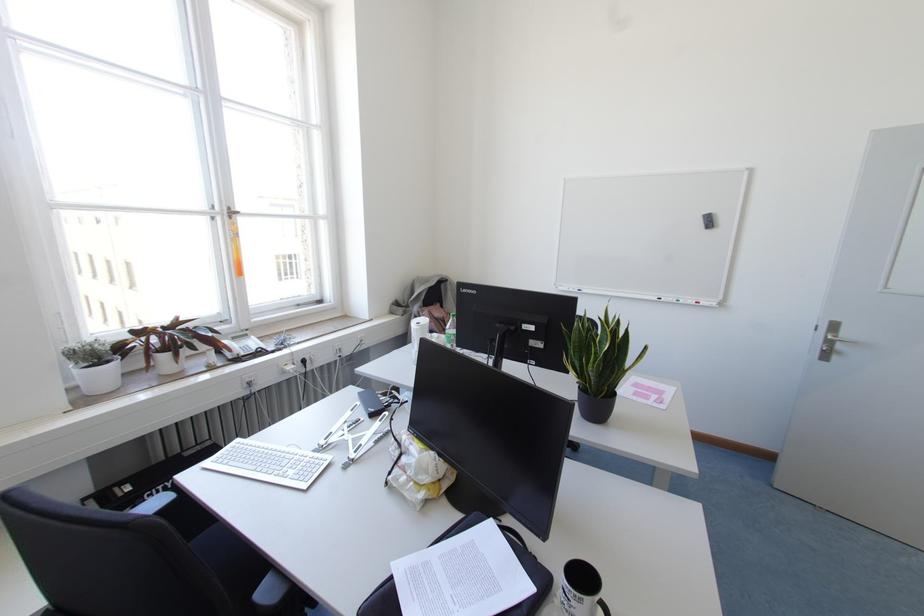
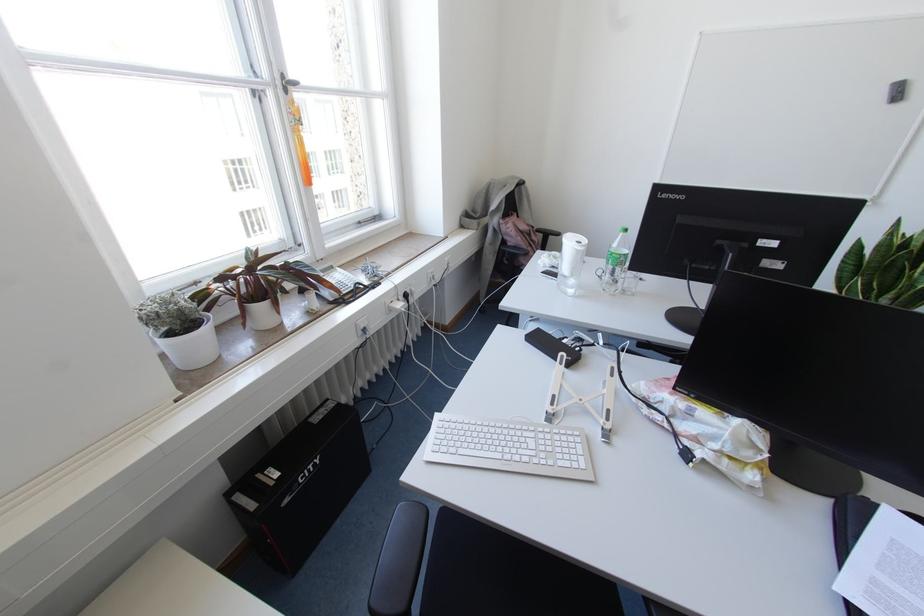
Find the pixel in the second image that matches pixel 251 336 in the first image.

(336, 268)